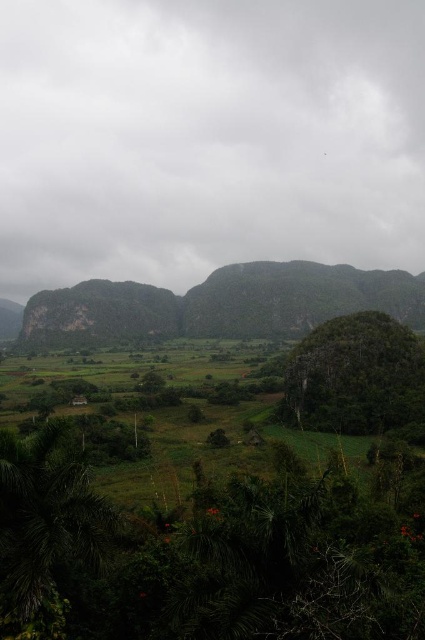
Does gray cloudy sky at upper center have a smaller size compared to rugged stone mountain at center?

Incorrect, gray cloudy sky at upper center is not smaller in size than rugged stone mountain at center.

Can you confirm if gray cloudy sky at upper center is bigger than rugged stone mountain at center?

Yes.

The height and width of the screenshot is (640, 425). Describe the element at coordinates (207, 138) in the screenshot. I see `gray cloudy sky at upper center` at that location.

Where is `gray cloudy sky at upper center`? The height and width of the screenshot is (640, 425). gray cloudy sky at upper center is located at coordinates pos(207,138).

Locate an element on the screen. The width and height of the screenshot is (425, 640). green grassy field at lower center is located at coordinates (223, 509).

Is rocky gray mountain at center to the left of green leafy tree at lower left from the viewer's perspective?

No, rocky gray mountain at center is not to the left of green leafy tree at lower left.

Between rocky gray mountain at center and green leafy tree at lower left, which one is positioned lower?

Positioned lower is green leafy tree at lower left.

Who is more forward, (277, 323) or (45, 436)?

Point (45, 436)

What are the coordinates of `rocky gray mountain at center` in the screenshot? It's located at (221, 305).